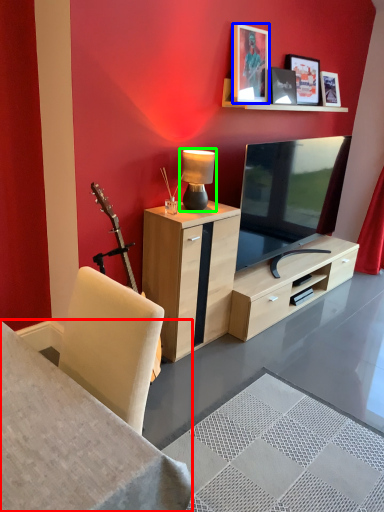
Question: Estimate the real-world distances between objects in this image. Which object is farther from desk (highlighted by a red box), picture frame (highlighted by a blue box) or table lamp (highlighted by a green box)?

Choices:
 (A) picture frame
 (B) table lamp

Answer: (A)